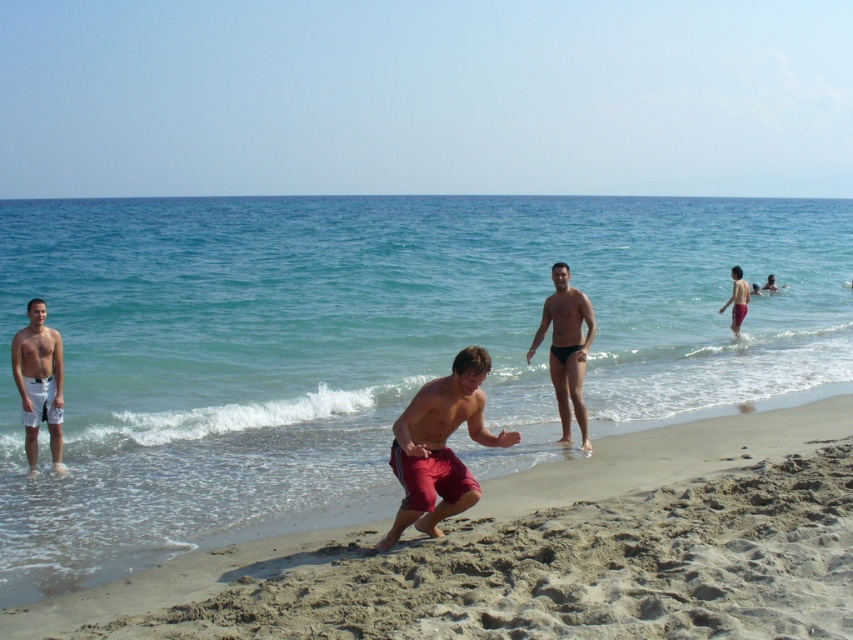
Question: Is red cotton shorts at center bigger than smooth black swim trunks at center?

Choices:
 (A) yes
 (B) no

Answer: (B)

Question: Is red cotton shorts at center positioned in front of white matte shorts at left?

Choices:
 (A) yes
 (B) no

Answer: (A)

Question: Does blue water at center come in front of smooth black swim trunks at center?

Choices:
 (A) yes
 (B) no

Answer: (A)

Question: Which point is farther to the camera?

Choices:
 (A) (730, 289)
 (B) (27, 330)
 (C) (468, 486)
 (D) (567, 410)

Answer: (A)

Question: Which object is closer to the camera taking this photo?

Choices:
 (A) blue water at center
 (B) white matte shorts at left
 (C) red fabric shorts at right
 (D) smooth black swim trunks at center

Answer: (A)

Question: Considering the real-world distances, which object is closest to the red fabric shorts at right?

Choices:
 (A) white matte shorts at left
 (B) red cotton shorts at center

Answer: (A)